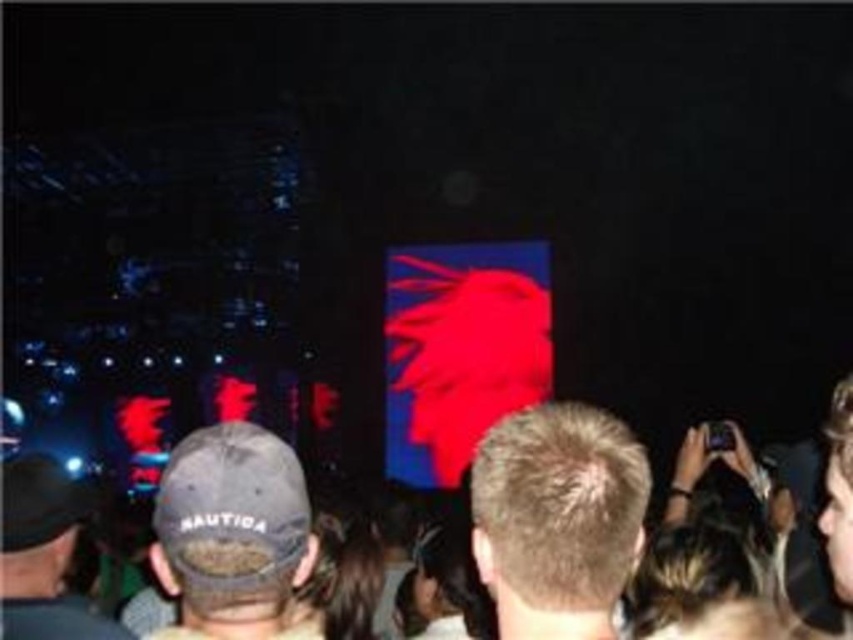
Can you confirm if blonde hair at center is positioned to the right of camo fabric baseball cap at lower left?

Indeed, blonde hair at center is positioned on the right side of camo fabric baseball cap at lower left.

Is blonde hair at center bigger than camo fabric baseball cap at lower left?

Correct, blonde hair at center is larger in size than camo fabric baseball cap at lower left.

Locate an element on the screen. The image size is (853, 640). blonde hair at center is located at coordinates (556, 518).

Is point (83, 497) less distant than point (833, 518)?

No, it is behind (833, 518).

The height and width of the screenshot is (640, 853). What are the coordinates of `dark gray baseball cap at lower left` in the screenshot? It's located at (44, 554).

Can you confirm if blonde hair at center is positioned to the left of light brown leather cap at upper center?

Correct, you'll find blonde hair at center to the left of light brown leather cap at upper center.

Who is positioned more to the left, blonde hair at center or light brown leather cap at upper center?

From the viewer's perspective, blonde hair at center appears more on the left side.

Measure the distance between blonde hair at center and camera.

A distance of 2.51 meters exists between blonde hair at center and camera.

Where is `blonde hair at center`? blonde hair at center is located at coordinates (556, 518).